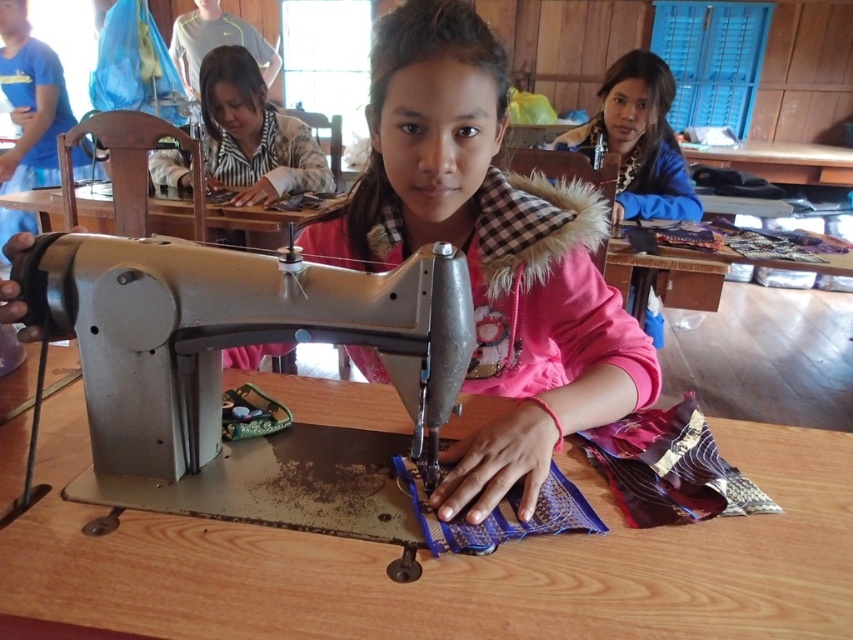
Question: Which point is farther from the camera taking this photo?

Choices:
 (A) (397, 209)
 (B) (67, 403)
 (C) (669, 106)
 (D) (165, 170)

Answer: (D)

Question: In this image, where is wooden table at center located relative to metallic sewing machine at center?

Choices:
 (A) above
 (B) below

Answer: (B)

Question: Among these objects, which one is nearest to the camera?

Choices:
 (A) striped shirt at upper left
 (B) metallic sewing machine at center
 (C) blue fuzzy jacket at upper right
 (D) wooden table at center

Answer: (D)

Question: Does wooden table at center have a smaller size compared to striped shirt at upper left?

Choices:
 (A) yes
 (B) no

Answer: (A)

Question: Among these objects, which one is farthest from the camera?

Choices:
 (A) striped shirt at upper left
 (B) wooden table at center
 (C) blue fuzzy jacket at upper right
 (D) pink fleece jacket at center

Answer: (A)

Question: Does wooden table at center appear over pink fleece jacket at center?

Choices:
 (A) yes
 (B) no

Answer: (B)